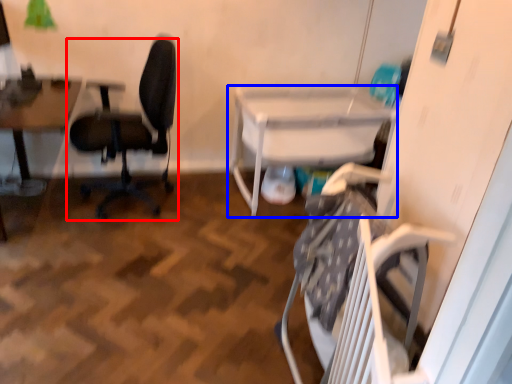
Question: Which of the following is the closest to the observer, chair (highlighted by a red box) or table (highlighted by a blue box)?

Choices:
 (A) chair
 (B) table

Answer: (A)